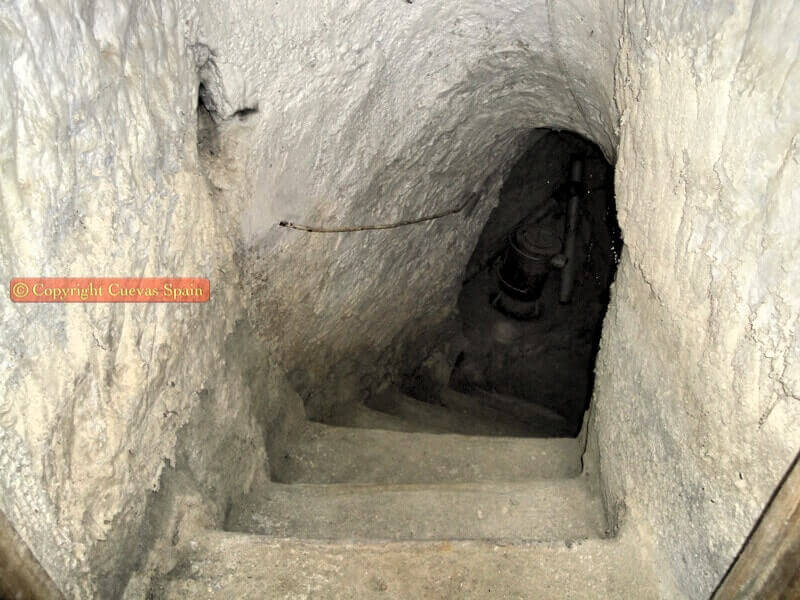
What are the coordinates of `doorway` in the screenshot? It's located at (590, 265).